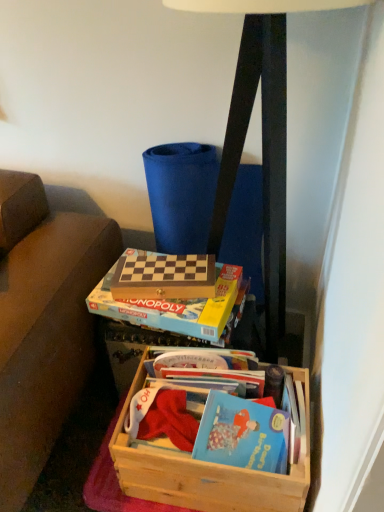
At what (x,y) coordinates should I click in order to perform the action: click on free location above hardcover book at center, which is counted as the 1th paperback book, starting from the front (from a real-world perspective). Please return your answer as a coordinate pair (x, y). The width and height of the screenshot is (384, 512). Looking at the image, I should click on (156, 292).